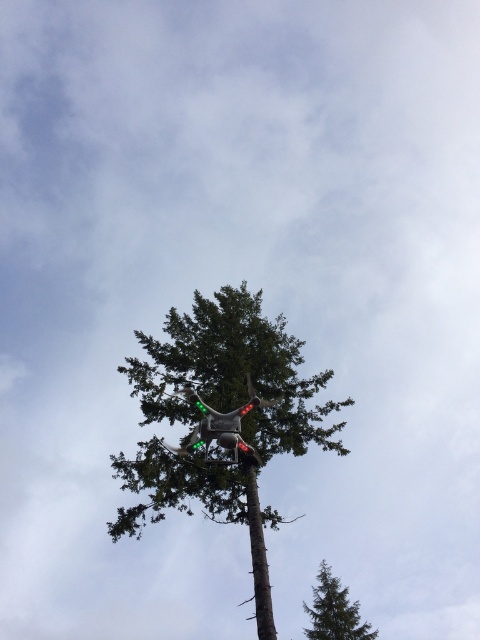
You are a pilot flying a small airplane and need to land safely. You notice the green matte drone at center and the green matte tree at center in your line of sight. Which object is closer to your aircraft?

The green matte drone at center is 62.51 feet away from green matte tree at center. Since the drone is closer to the tree than the tree is to the aircraft, the tree would be farther away. Therefore, the green matte drone at center is closer to your aircraft.

You are a pilot observing the green matte drone at center and the green matte tree at center in the image. Which object has a greater width?

The green matte drone at center has a greater width than the green matte tree at center according to the description.